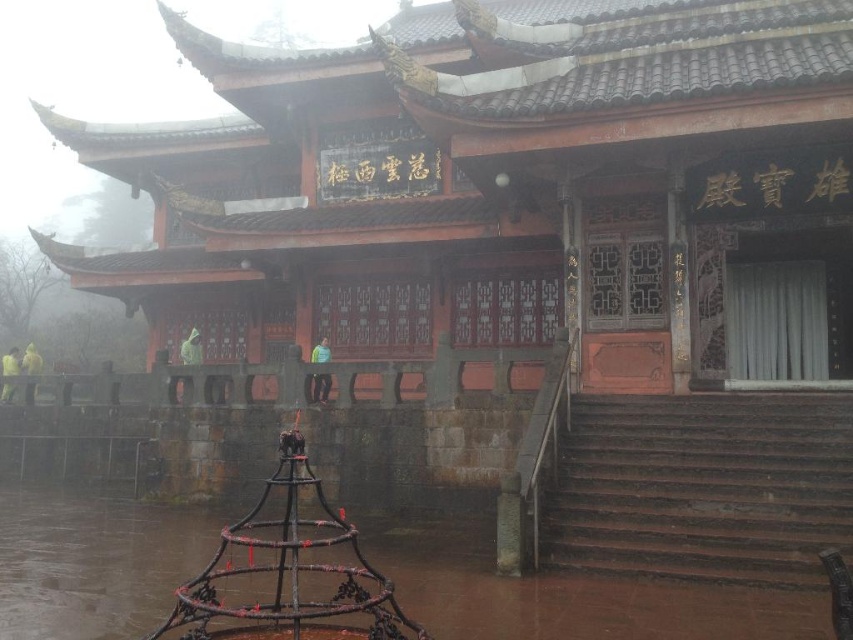
Is brown concrete stairs at lower right shorter than yellow fabric person at center?

In fact, brown concrete stairs at lower right may be taller than yellow fabric person at center.

Who is positioned more to the right, brown concrete stairs at lower right or yellow fabric person at center?

brown concrete stairs at lower right

Who is more forward, (746, 445) or (328, 352)?

Point (746, 445) is more forward.

This screenshot has width=853, height=640. What are the coordinates of `brown concrete stairs at lower right` in the screenshot? It's located at tap(701, 486).

Can you confirm if yellow fabric person at left is wider than yellow matte jacket at left?

Indeed, yellow fabric person at left has a greater width compared to yellow matte jacket at left.

Is yellow fabric person at left below yellow matte jacket at left?

Incorrect, yellow fabric person at left is not positioned below yellow matte jacket at left.

The height and width of the screenshot is (640, 853). What do you see at coordinates (32, 360) in the screenshot? I see `yellow fabric person at left` at bounding box center [32, 360].

Locate an element on the screen. The image size is (853, 640). yellow fabric person at left is located at coordinates (32, 360).

Which is behind, point (314, 401) or point (15, 362)?

Point (15, 362)

Is yellow fabric person at center above yellow matte jacket at left?

Yes.

Does point (320, 362) come in front of point (9, 388)?

Yes, it is.

At what (x,y) coordinates should I click in order to perform the action: click on yellow fabric person at center. Please return your answer as a coordinate pair (x, y). The width and height of the screenshot is (853, 640). Looking at the image, I should click on (320, 387).